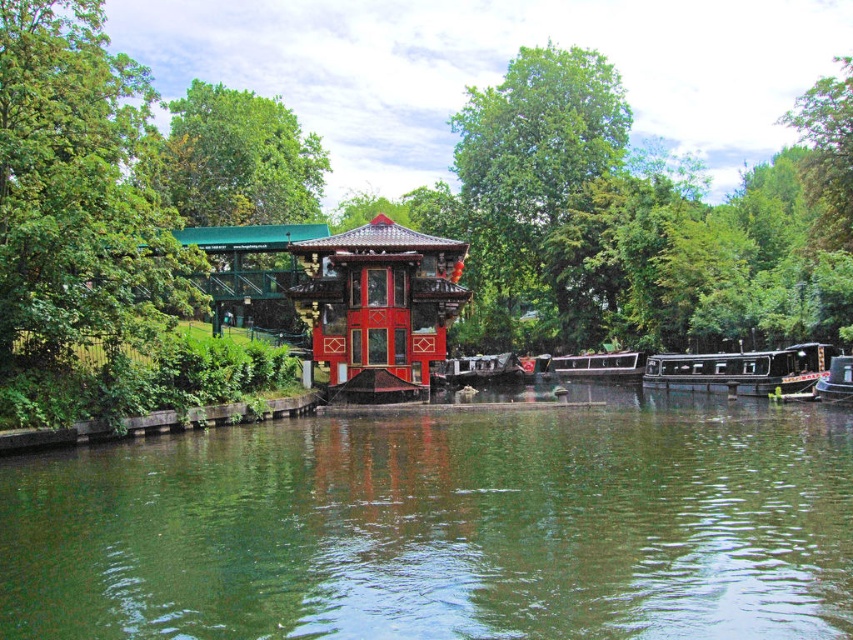
Question: Does green smooth water at center appear under green leafy tree at left?

Choices:
 (A) yes
 (B) no

Answer: (A)

Question: Observing the image, what is the correct spatial positioning of green smooth water at center in reference to black polished wood barge at lower right?

Choices:
 (A) below
 (B) above

Answer: (A)

Question: Which of the following is the farthest from the observer?

Choices:
 (A) (151, 268)
 (B) (821, 385)
 (C) (637, 464)
 (D) (410, 392)

Answer: (D)

Question: Which object is the closest to the green smooth water at center?

Choices:
 (A) black polished wood barge at right
 (B) green leafy tree at left
 (C) black polished wood barge at lower right

Answer: (B)

Question: Is shiny red gazebo at center smaller than black polished wood barge at right?

Choices:
 (A) no
 (B) yes

Answer: (A)

Question: Which object is farther from the camera taking this photo?

Choices:
 (A) green smooth water at center
 (B) black polished wood barge at lower right

Answer: (B)